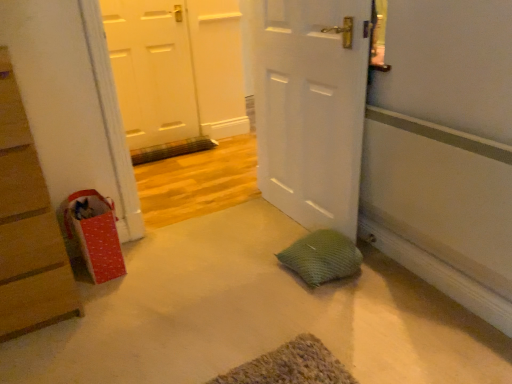
The image size is (512, 384). In order to click on free space between white matte door at center, which ranks as the 1th door in right-to-left order, and red dotted paper bag at left in this screenshot , I will do (x=204, y=247).